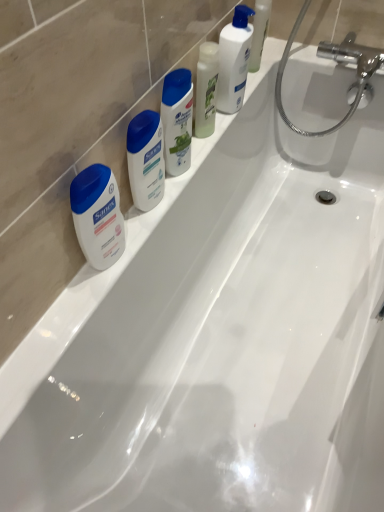
Question: Considering the relative sizes of white glossy lotion at upper center, positioned as the third cleaning product in left-to-right order, and white glossy shampoo at center, the 1th cleaning product viewed from the left, in the image provided, is white glossy lotion at upper center, positioned as the third cleaning product in left-to-right order, smaller than white glossy shampoo at center, the 1th cleaning product viewed from the left,?

Choices:
 (A) no
 (B) yes

Answer: (A)

Question: Does white glossy lotion at upper center, positioned as the third cleaning product in left-to-right order, appear on the left side of white glossy shampoo at center, the 1th cleaning product viewed from the left?

Choices:
 (A) no
 (B) yes

Answer: (A)

Question: From a real-world perspective, does white glossy lotion at upper center, which appears as the first cleaning product when viewed from the right, sit lower than white glossy shampoo at center, which is the 3th cleaning product in right-to-left order?

Choices:
 (A) yes
 (B) no

Answer: (B)

Question: Could you tell me if white glossy lotion at upper center, which appears as the first cleaning product when viewed from the right, is facing white glossy shampoo at center, the 1th cleaning product viewed from the left?

Choices:
 (A) yes
 (B) no

Answer: (B)

Question: From the image's perspective, would you say white glossy lotion at upper center, which appears as the first cleaning product when viewed from the right, is positioned over white glossy shampoo at center, which is the 3th cleaning product in right-to-left order?

Choices:
 (A) no
 (B) yes

Answer: (B)

Question: Considering the positions of white glossy shampoo at center, which is the 3th cleaning product in right-to-left order, and translucent plastic bottle at upper center, marked as the second cleaning product in a right-to-left arrangement, in the image, is white glossy shampoo at center, which is the 3th cleaning product in right-to-left order, taller or shorter than translucent plastic bottle at upper center, marked as the second cleaning product in a right-to-left arrangement,?

Choices:
 (A) tall
 (B) short

Answer: (A)

Question: Relative to translucent plastic bottle at upper center, the 2th cleaning product viewed from the left, is white glossy shampoo at center, which is the 3th cleaning product in right-to-left order, in front or behind?

Choices:
 (A) front
 (B) behind

Answer: (A)

Question: Considering the positions of white glossy shampoo at center, the 1th cleaning product viewed from the left, and translucent plastic bottle at upper center, marked as the second cleaning product in a right-to-left arrangement, in the image, is white glossy shampoo at center, the 1th cleaning product viewed from the left, wider or thinner than translucent plastic bottle at upper center, marked as the second cleaning product in a right-to-left arrangement,?

Choices:
 (A) thin
 (B) wide

Answer: (B)

Question: Choose the correct answer: Is white glossy shampoo at center, which is the 3th cleaning product in right-to-left order, inside translucent plastic bottle at upper center, marked as the second cleaning product in a right-to-left arrangement, or outside it?

Choices:
 (A) inside
 (B) outside

Answer: (B)

Question: Would you say white glossy lotion at upper center, which appears as the first cleaning product when viewed from the right, is inside or outside white glossy shampoo at center, which is the 3th cleaning product in right-to-left order?

Choices:
 (A) inside
 (B) outside

Answer: (B)

Question: Considering the positions of white glossy lotion at upper center, which appears as the first cleaning product when viewed from the right, and white glossy shampoo at center, which is the 3th cleaning product in right-to-left order, in the image, is white glossy lotion at upper center, which appears as the first cleaning product when viewed from the right, wider or thinner than white glossy shampoo at center, which is the 3th cleaning product in right-to-left order,?

Choices:
 (A) wide
 (B) thin

Answer: (A)

Question: Relative to white glossy shampoo at center, which is the 3th cleaning product in right-to-left order, is white glossy lotion at upper center, positioned as the third cleaning product in left-to-right order, in front or behind?

Choices:
 (A) front
 (B) behind

Answer: (B)

Question: Is point (220, 94) closer or farther from the camera than point (180, 82)?

Choices:
 (A) farther
 (B) closer

Answer: (A)

Question: Considering the positions of white glossy lotion at upper center, which appears as the first cleaning product when viewed from the right, and white matte sanex soap at left, the 1th toiletry when ordered from left to right, in the image, is white glossy lotion at upper center, which appears as the first cleaning product when viewed from the right, taller or shorter than white matte sanex soap at left, the 1th toiletry when ordered from left to right,?

Choices:
 (A) short
 (B) tall

Answer: (B)

Question: From the image's perspective, is white glossy lotion at upper center, positioned as the third cleaning product in left-to-right order, located above or below white matte sanex soap at left, placed as the second toiletry when sorted from right to left?

Choices:
 (A) below
 (B) above

Answer: (B)